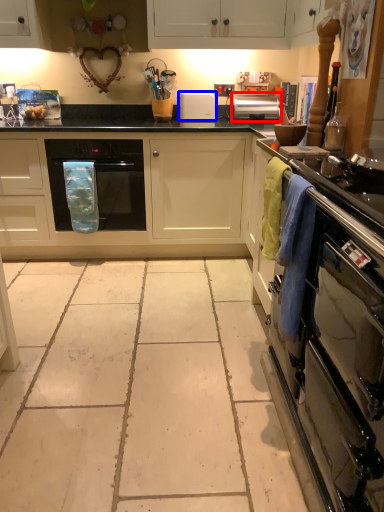
Question: Which point is further to the camera, kitchen appliance (highlighted by a red box) or appliance (highlighted by a blue box)?

Choices:
 (A) kitchen appliance
 (B) appliance

Answer: (B)